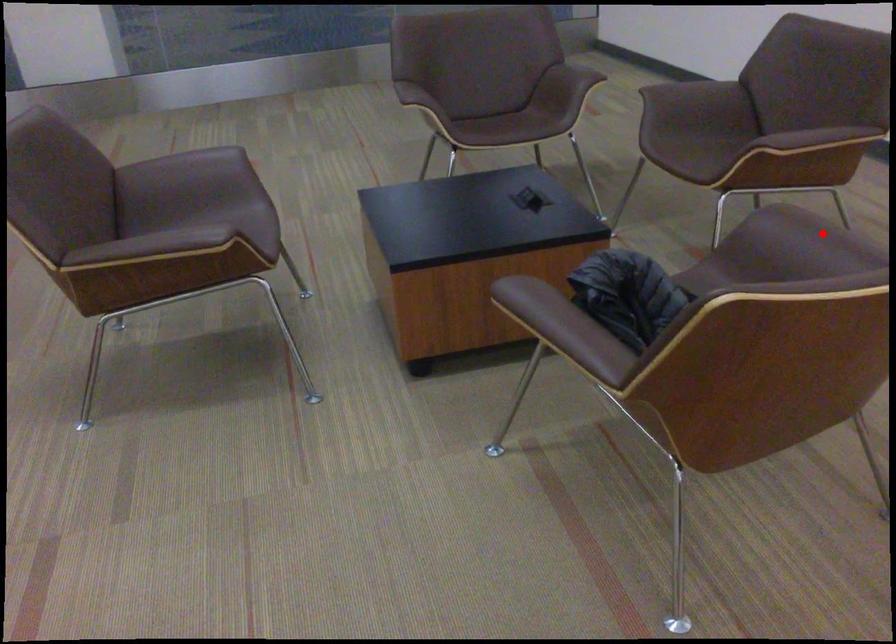
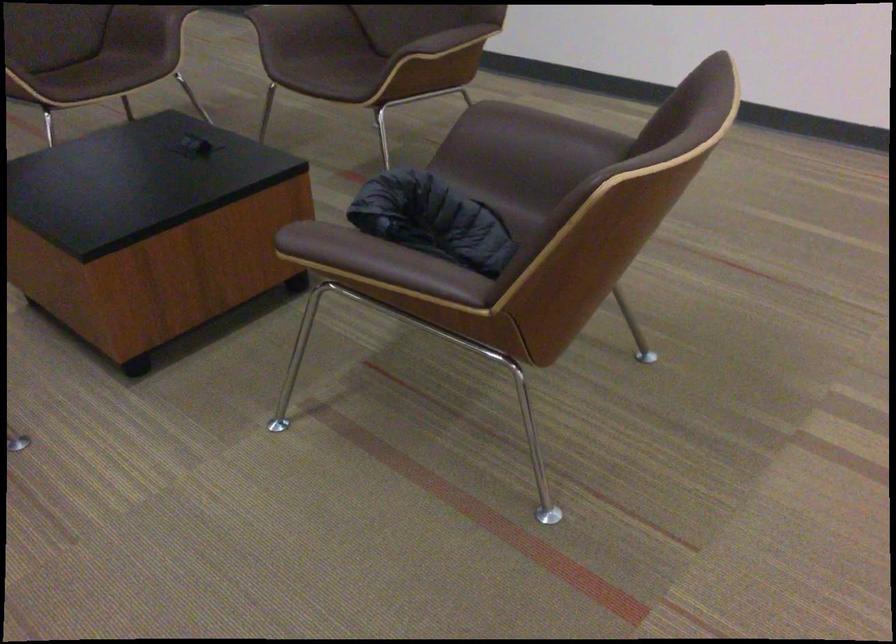
Where in the second image is the point corresponding to the highlighted location from the first image?

(545, 128)